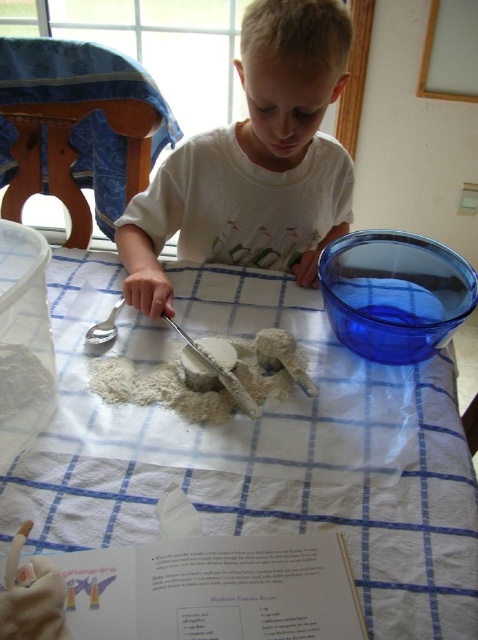
You are a parent observing your child in the kitchen. You notice the white matte shirt at upper center and the transparent plastic bowl at upper right on the table. Which object is wider?

The white matte shirt at upper center is wider than the transparent plastic bowl at upper right.

You are a parent watching your child cook. You notice the white matte shirt at upper center and the white matte dough at center. Which object is closer to you?

The white matte shirt at upper center is closer to you because it is further to the viewer than the white matte dough at center.

You are a photographer taking a picture of the cooking scene. You notice two points in the image at coordinates point (362, 291) and point (174, 324). Which point will appear closer to the camera in the photo?

Point (174, 324) will appear closer to the camera because it is closer to the viewer than point (362, 291), which is further away.